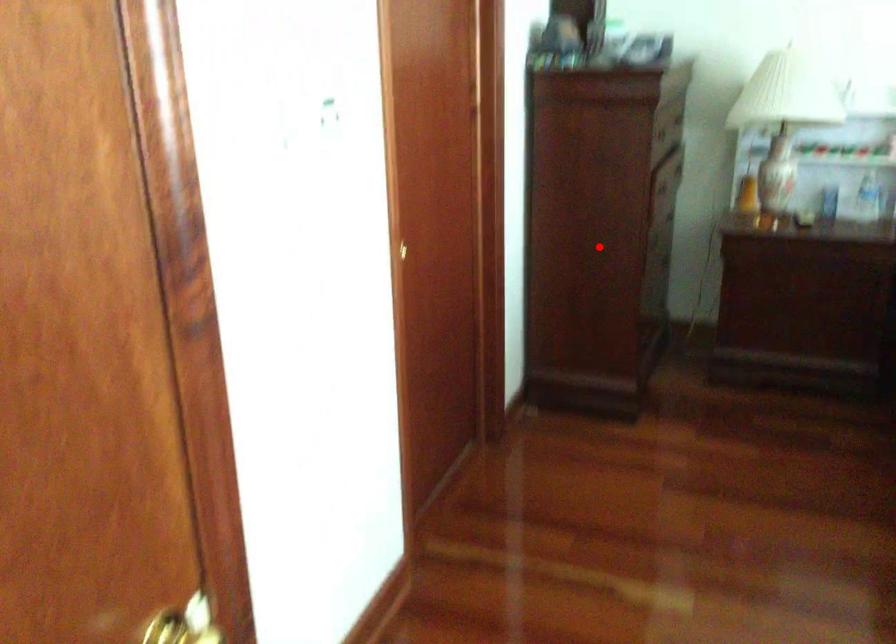
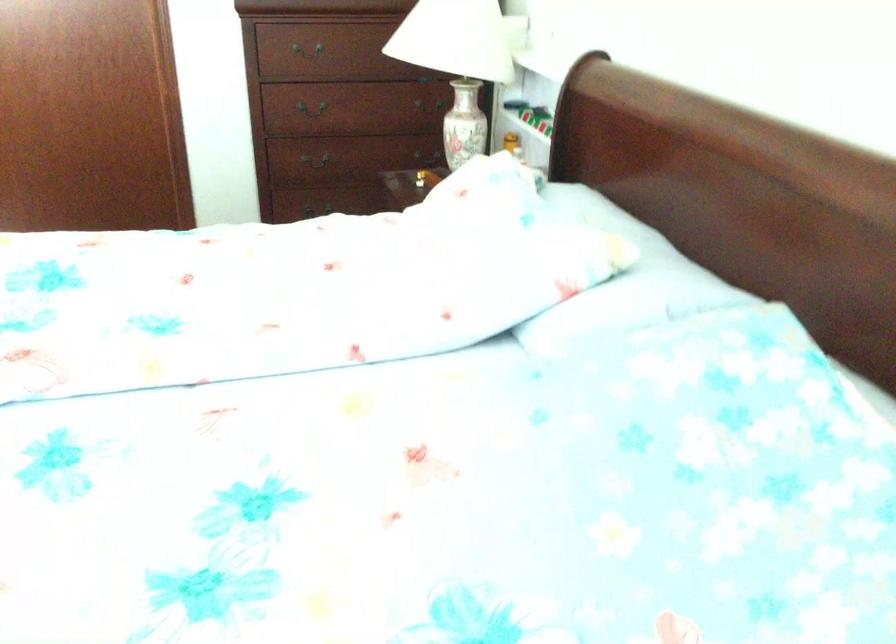
Where in the second image is the point corresponding to the highlighted location from the first image?

(323, 158)